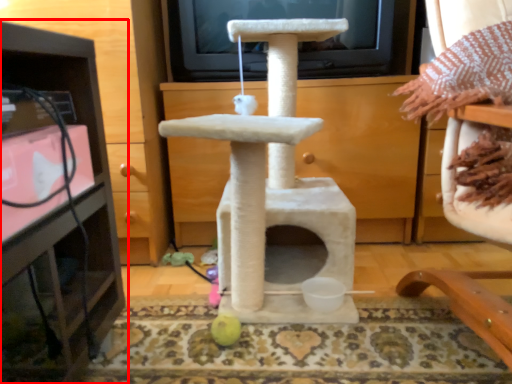
Question: From the image's perspective, where is furniture (annotated by the red box) located in relation to furniture in the image?

Choices:
 (A) below
 (B) above

Answer: (B)